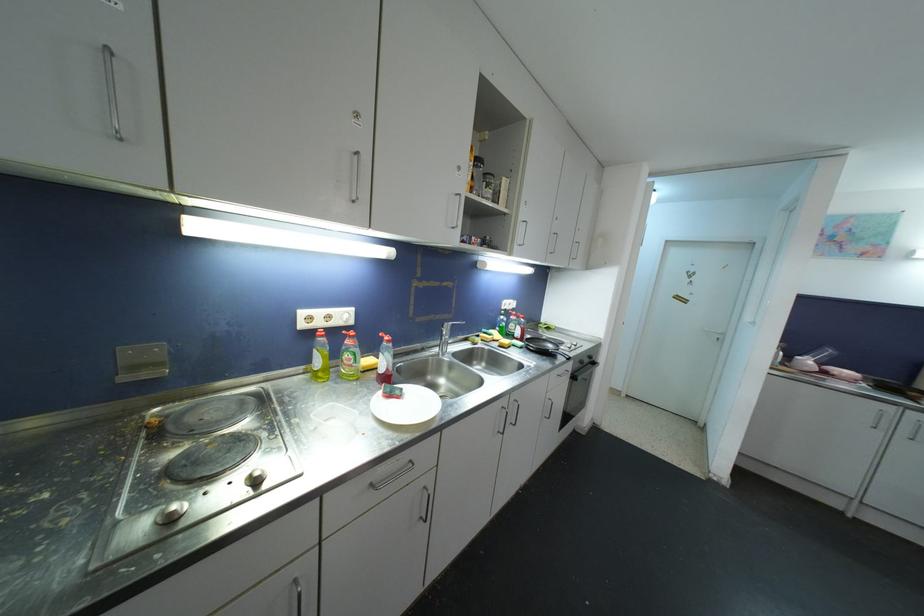
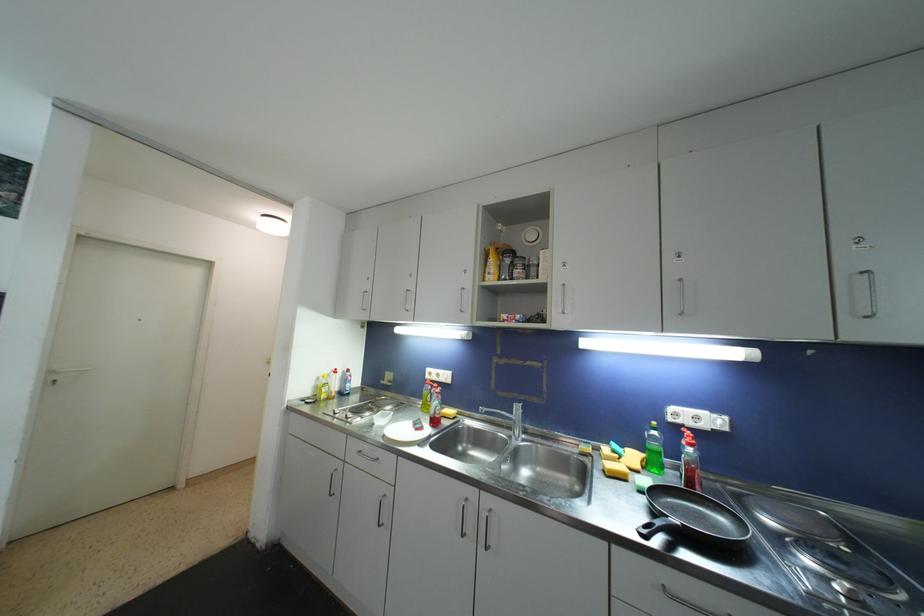
Locate, in the second image, the point that corresponds to (x=516, y=320) in the first image.

(687, 445)